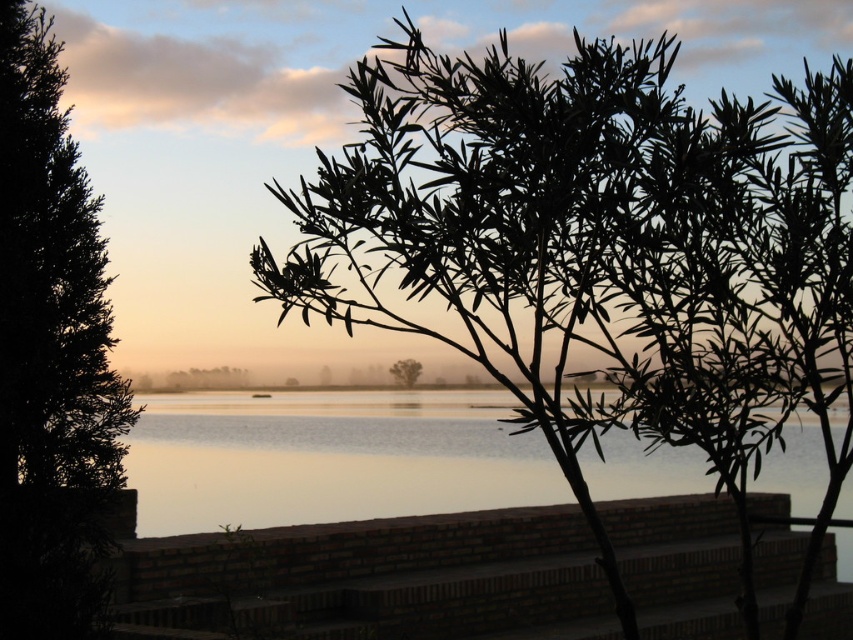
You are an artist trying to sketch the scene. You notice the silhouette leafy branch at upper center and the green leafy tree at center. Which object is located to the right of the other?

The silhouette leafy branch at upper center is positioned on the right side of green leafy tree at center.

Looking at this image, you are an artist sketching this scene and want to place a bird in the image. The bird should be positioned exactly 0.1 units to the right and 0.05 units above the silhouette leafy branch at upper center. Where should you place the bird in terms of coordinates?

The silhouette leafy branch at upper center is located at coordinates (583, 250). Adding 0.1 to the x coordinate and 0.05 to the y coordinate gives the bird position at (625, 314).